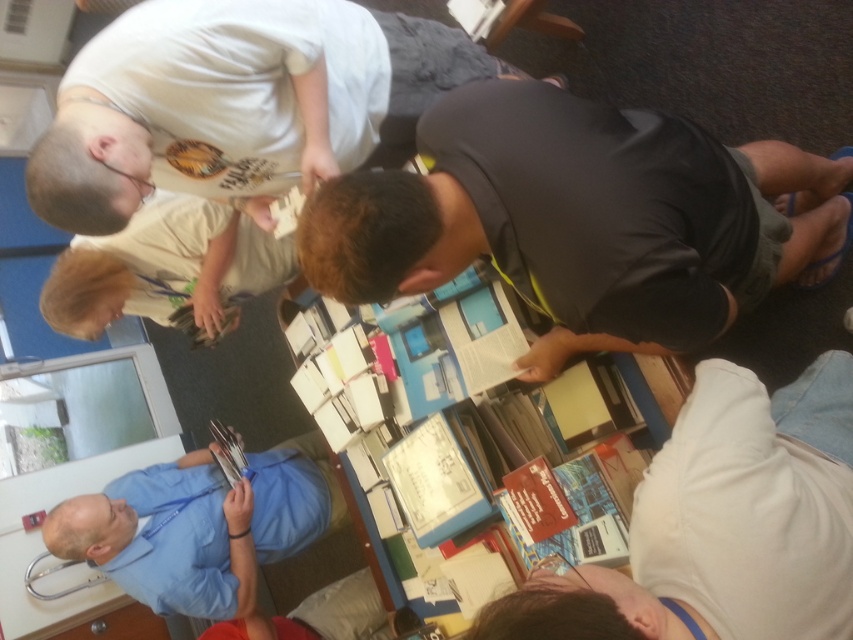
Question: Can you confirm if black matte shirt at center is wider than blue fabric shirt at lower left?

Choices:
 (A) no
 (B) yes

Answer: (B)

Question: Estimate the real-world distances between objects in this image. Which object is farther from the white matte shirt at upper left?

Choices:
 (A) black matte shirt at center
 (B) white fabric shirt at lower right

Answer: (B)

Question: Which is farther from the white t-shirt at upper left?

Choices:
 (A) black matte shirt at center
 (B) blue fabric shirt at lower left
 (C) white matte shirt at upper left
 (D) white fabric shirt at lower right

Answer: (B)

Question: Is blue fabric shirt at lower left to the right of white matte shirt at upper left from the viewer's perspective?

Choices:
 (A) yes
 (B) no

Answer: (A)

Question: Considering the real-world distances, which object is farthest from the white t-shirt at upper left?

Choices:
 (A) white fabric shirt at lower right
 (B) white matte shirt at upper left

Answer: (A)

Question: Is the position of white fabric shirt at lower right less distant than that of blue fabric shirt at lower left?

Choices:
 (A) yes
 (B) no

Answer: (A)